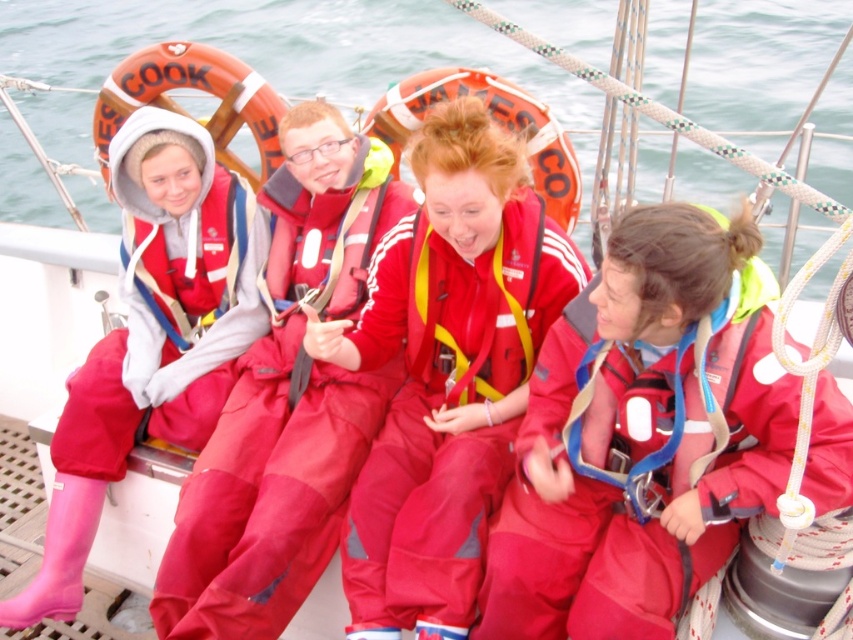
Can you confirm if pink rubber boots at left is positioned to the right of matte red jumpsuit at left?

Incorrect, pink rubber boots at left is not on the right side of matte red jumpsuit at left.

Based on the photo, who is more forward, (196,192) or (105,385)?

Positioned in front is point (105,385).

Is point (132, 324) more distant than point (117, 346)?

Yes, it is.

This screenshot has height=640, width=853. Identify the location of pink rubber boots at left. (151, 337).

Can you confirm if transparent water at center is shorter than shiny red life jacket at center?

In fact, transparent water at center may be taller than shiny red life jacket at center.

Does transparent water at center appear under shiny red life jacket at center?

No.

Where is `transparent water at center`? Image resolution: width=853 pixels, height=640 pixels. transparent water at center is located at coordinates (294, 49).

Image resolution: width=853 pixels, height=640 pixels. In order to click on transparent water at center in this screenshot , I will do `click(294, 49)`.

Is point (474, 212) closer to camera compared to point (131, 253)?

Yes, it is.

Does matte red life jacket at center appear under white fleece life jacket at left?

Yes, matte red life jacket at center is below white fleece life jacket at left.

Is point (517, 227) behind point (148, 234)?

No, it is not.

At what (x,y) coordinates should I click in order to perform the action: click on matte red life jacket at center. Please return your answer as a coordinate pair (x, y). Looking at the image, I should click on (445, 371).